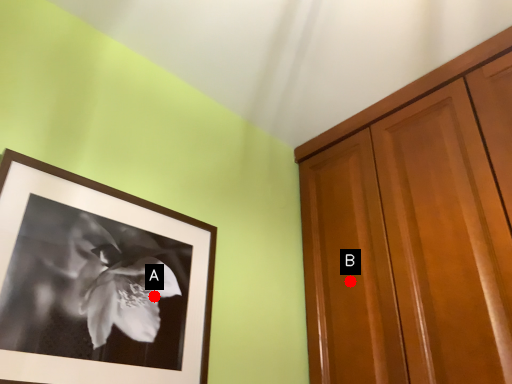
Question: Two points are circled on the image, labeled by A and B beside each circle. Among these points, which one is nearest to the camera?

Choices:
 (A) A is closer
 (B) B is closer

Answer: (A)